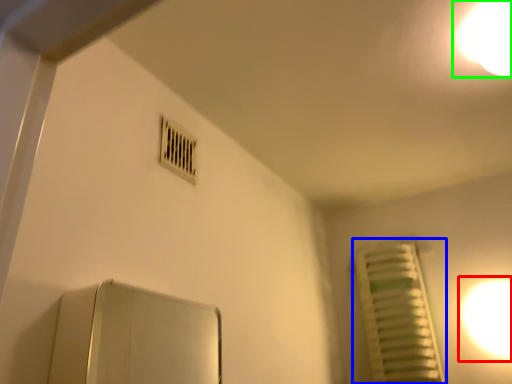
Question: Which object is the closest to the light (highlighted by a red box)? Choose among these: radiator (highlighted by a blue box) or light (highlighted by a green box).

Choices:
 (A) radiator
 (B) light

Answer: (A)